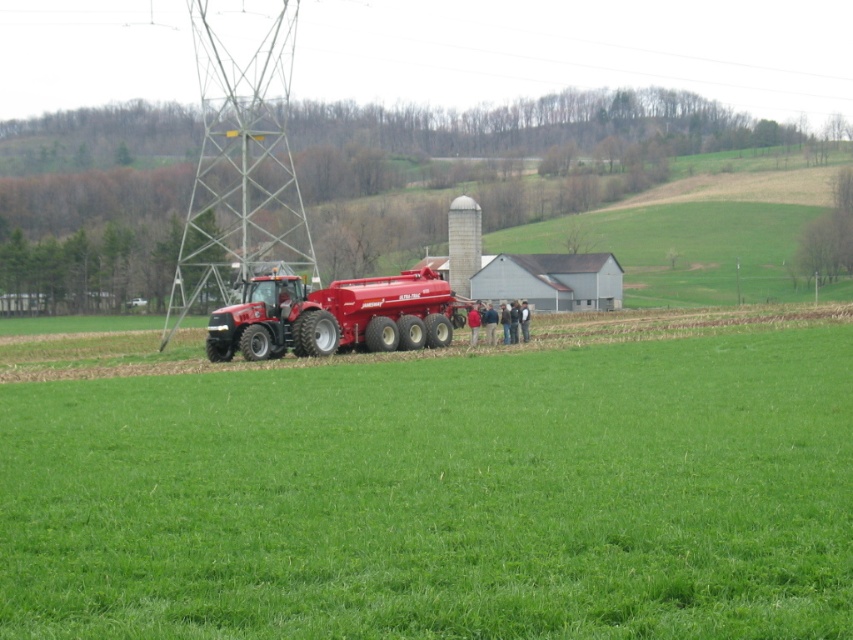
Between green grassy field at center and matte red tractor at center, which one appears on the right side from the viewer's perspective?

Positioned to the right is green grassy field at center.

Can you confirm if green grassy field at center is thinner than matte red tractor at center?

In fact, green grassy field at center might be wider than matte red tractor at center.

You are a GUI agent. You are given a task and a screenshot of the screen. Output one action in this format:
    pyautogui.click(x=<x>, y=<y>)
    Task: Click on the green grassy field at center
    
    Given the screenshot: What is the action you would take?
    pyautogui.click(x=440, y=497)